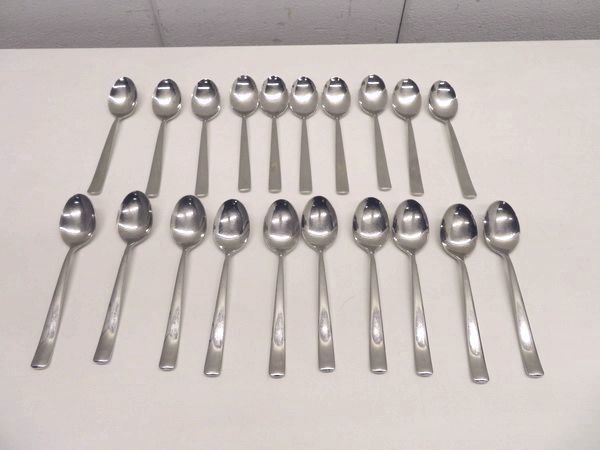
Locate an element on the screen. Image resolution: width=600 pixels, height=450 pixels. spoons on the top row is located at coordinates (122, 105), (169, 103), (210, 99), (247, 98), (275, 97), (307, 96), (337, 95), (372, 98), (411, 98), (449, 99).